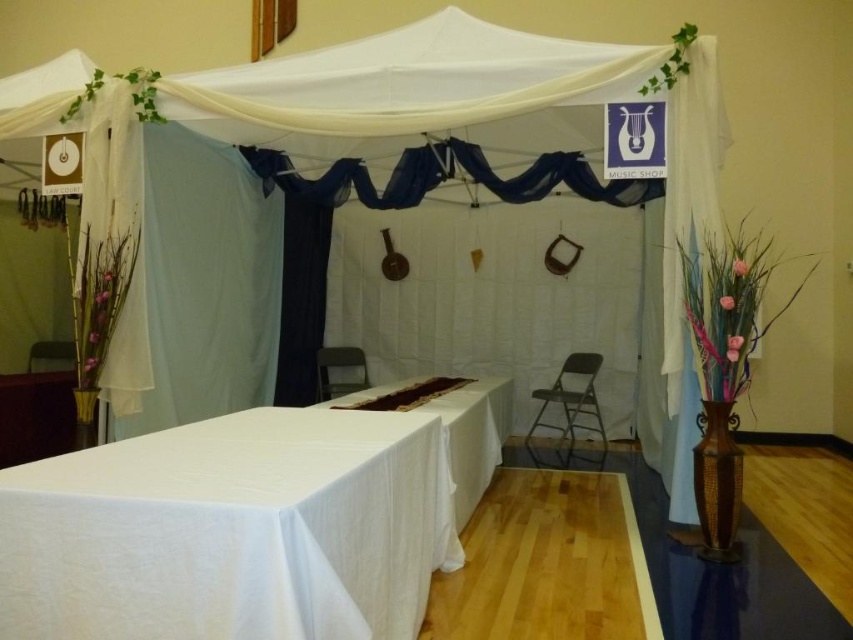
Does white cloth table at center appear over metallic gray chair at lower left?

No.

Does point (474, 390) come farther from viewer compared to point (57, 353)?

No, (474, 390) is closer to viewer.

Is point (471, 436) more distant than point (73, 346)?

No, it is not.

Locate an element on the screen. The height and width of the screenshot is (640, 853). white cloth table at center is located at coordinates (473, 436).

Between metallic gray folding chair at center and metallic gray chair at lower left, which one appears on the left side from the viewer's perspective?

From the viewer's perspective, metallic gray chair at lower left appears more on the left side.

Is point (572, 456) closer to camera compared to point (67, 342)?

Yes.

Find the location of `metallic gray folding chair at center`. metallic gray folding chair at center is located at coordinates (570, 410).

Is white fabric tablecloth at center bigger than metallic gray chair at lower left?

Correct, white fabric tablecloth at center is larger in size than metallic gray chair at lower left.

Which is behind, point (428, 452) or point (36, 349)?

Positioned behind is point (36, 349).

Where is `white fabric tablecloth at center`? The image size is (853, 640). white fabric tablecloth at center is located at coordinates (231, 531).